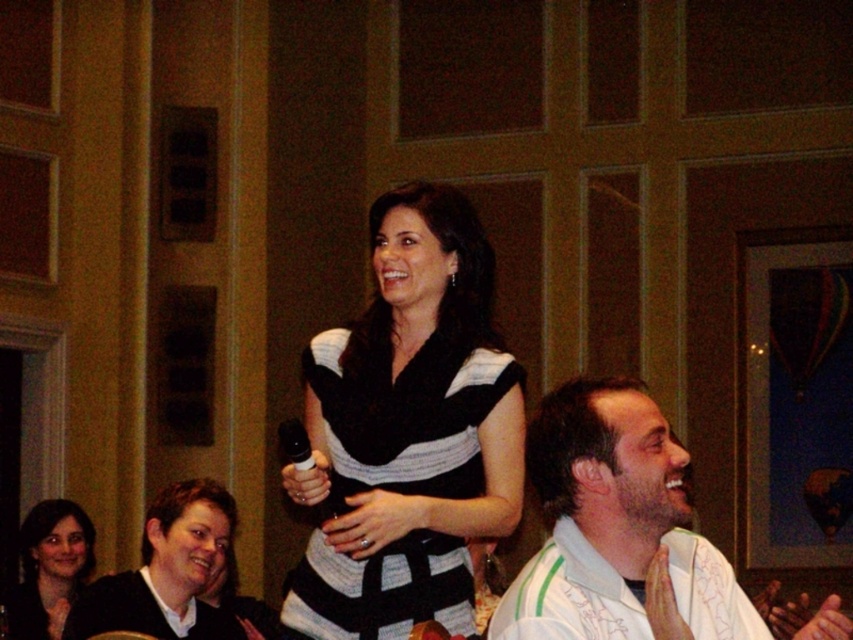
You are a photographer at the event and want to take a photo of the woman in the black and white horizontally striped dress. The camera you are using has a focal length of 50mm and requires a minimum distance of 10 feet to focus properly. Given that the white textured shirt at lower right and camera are 11.62 feet apart, can you take a clear photo of the woman?

The white textured shirt at lower right and camera are 11.62 feet apart. Since the minimum focusing distance required is 10 feet, the camera is at a sufficient distance to capture a clear photo of the woman in the black and white horizontally striped dress.

You are a photographer at the event and want to capture a photo of the black and white striped dress at center and the smooth skin face at lower left. Which object should you focus on first to ensure both are in the frame?

You should focus on the black and white striped dress at center first because it is in front of the smooth skin face at lower left, ensuring both will be in the frame when centered on the dress.

You are a photographer adjusting your camera settings to capture the scene. You need to focus on both the black and white striped dress at center and the smooth skin face at lower left. Given their sizes, which object should you adjust your focus on first to ensure proper exposure?

The black and white striped dress at center has a larger size compared to the smooth skin face at lower left, so you should focus on the black and white striped dress at center first to ensure proper exposure since it occupies more of the frame and requires adequate lighting adjustment.